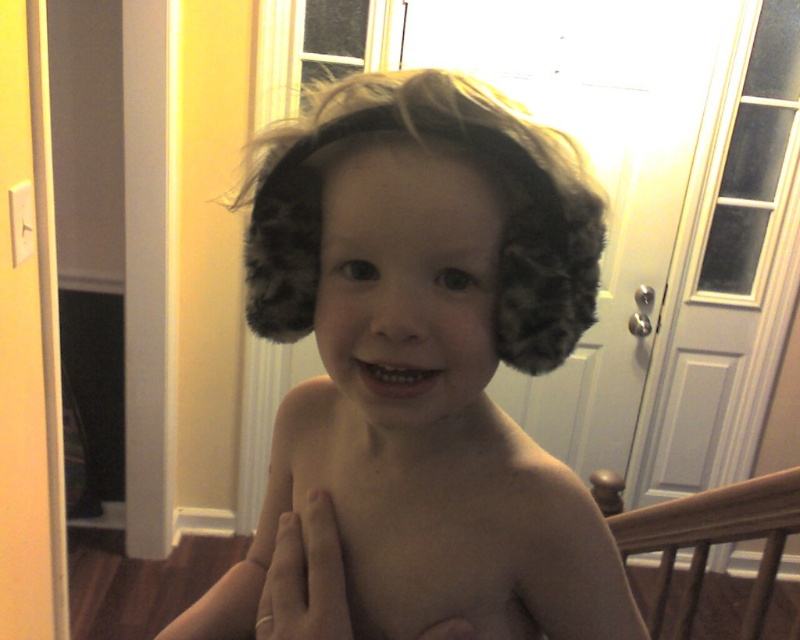
Question: Does brown wooden balustrade at lower right appear over gold ring at chest?

Choices:
 (A) no
 (B) yes

Answer: (A)

Question: Can you confirm if fuzzy brown earmuffs at center is positioned to the left of brown wooden balustrade at lower right?

Choices:
 (A) yes
 (B) no

Answer: (A)

Question: Can you confirm if fuzzy brown earmuffs at center is positioned to the left of fuzzy brown hair at center?

Choices:
 (A) yes
 (B) no

Answer: (A)

Question: Among these points, which one is nearest to the camera?

Choices:
 (A) (720, 516)
 (B) (388, 388)

Answer: (B)

Question: Estimate the real-world distances between objects in this image. Which object is farther from the fuzzy brown earmuffs at center?

Choices:
 (A) fuzzy brown hair at center
 (B) brown wooden balustrade at lower right

Answer: (B)

Question: Among these points, which one is nearest to the camera?

Choices:
 (A) coord(322,557)
 (B) coord(400,116)
 (C) coord(298,397)

Answer: (B)